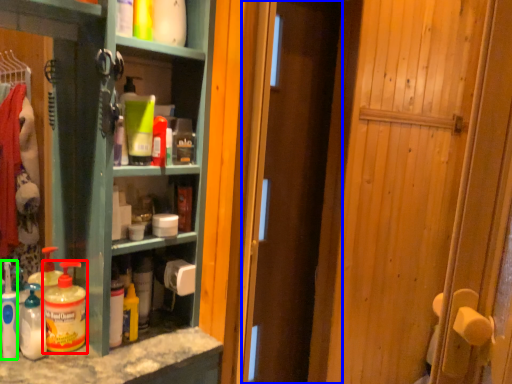
Question: Which object is positioned farthest from bottle (highlighted by a red box)? Select from door (highlighted by a blue box) and cleaning product (highlighted by a green box).

Choices:
 (A) door
 (B) cleaning product

Answer: (A)